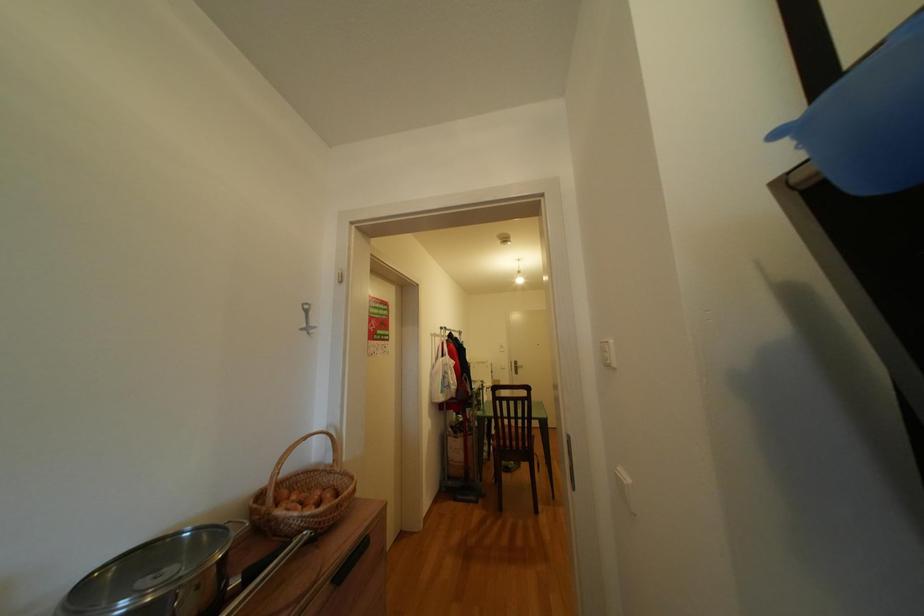
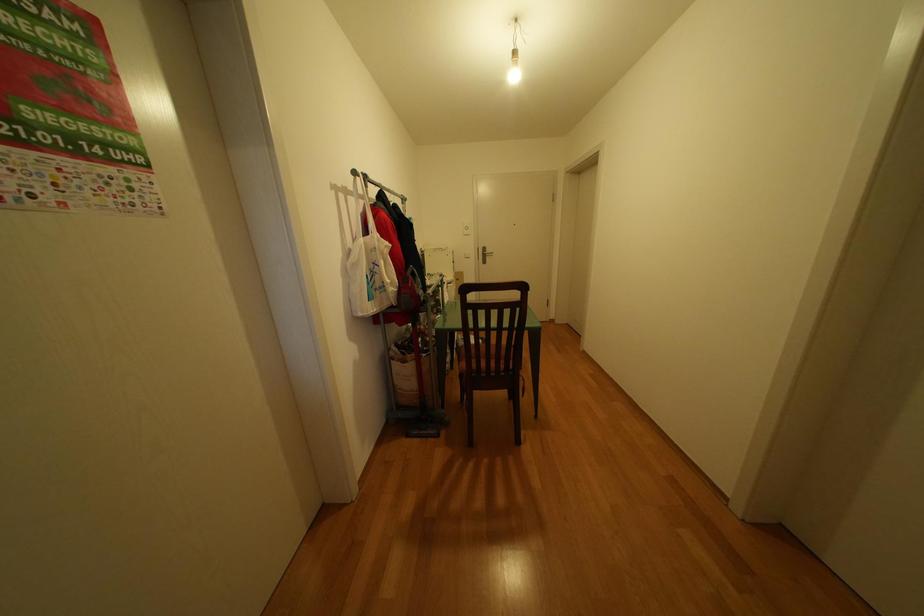
Question: The images are taken continuously from a first-person perspective. In which direction are you moving?

Choices:
 (A) Left
 (B) Right
 (C) Forward
 (D) Backward

Answer: (C)